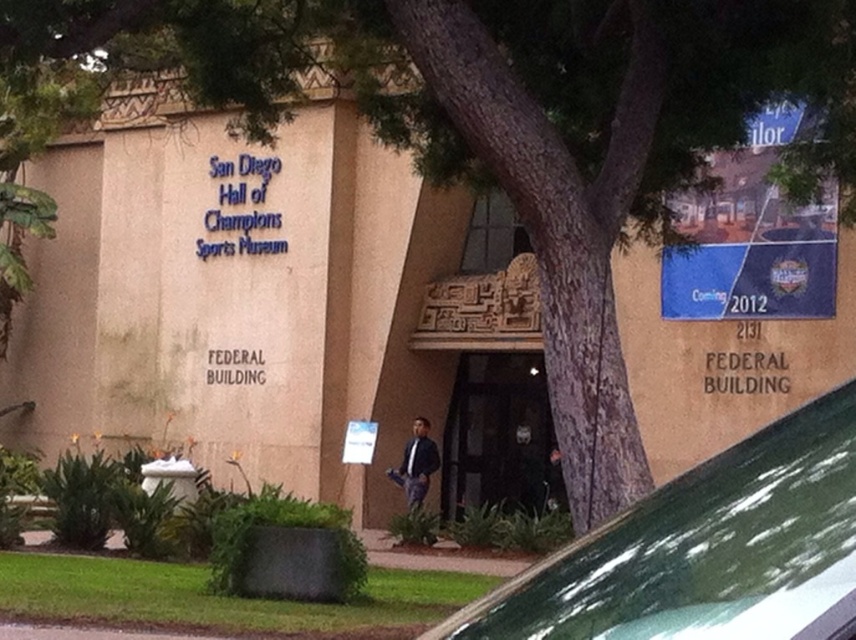
Question: Can you confirm if black glass door at center is positioned below dark blue jacket at center?

Choices:
 (A) yes
 (B) no

Answer: (B)

Question: Which point appears closest to the camera in this image?

Choices:
 (A) (409, 449)
 (B) (550, 486)

Answer: (A)

Question: Can you confirm if black glass door at center is thinner than dark blue jacket at center?

Choices:
 (A) no
 (B) yes

Answer: (A)

Question: Is green matte car at center below black glass door at center?

Choices:
 (A) no
 (B) yes

Answer: (A)

Question: Which point is farther to the camera?

Choices:
 (A) (742, 593)
 (B) (415, 420)
 (C) (533, 464)

Answer: (C)

Question: Which point is closer to the camera?

Choices:
 (A) pos(753,589)
 (B) pos(423,419)
 (C) pos(508,410)

Answer: (A)